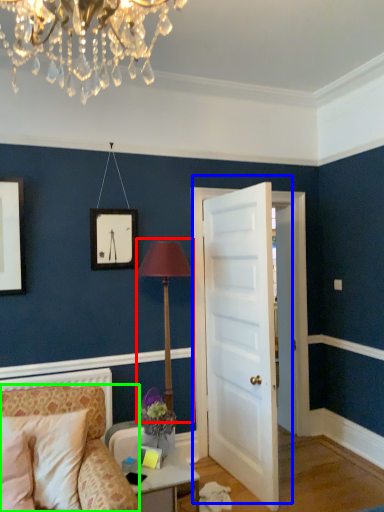
Question: Considering the real-world distances, which object is closest to table lamp (highlighted by a red box)? door (highlighted by a blue box) or chair (highlighted by a green box).

Choices:
 (A) door
 (B) chair

Answer: (A)